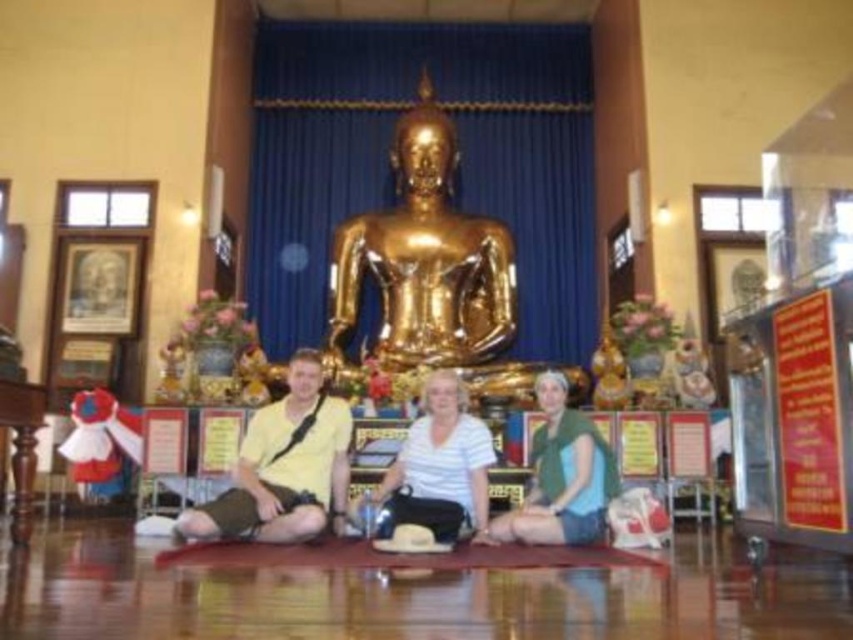
You are a tailor who needs to determine which shirt to alter first. Both the white matte shirt at center and the green matte shirt at center are on a hanger in front of you. Based on their sizes, which shirt requires more fabric to widen its width?

The green matte shirt at center requires more fabric to widen its width since it is wider than the white matte shirt at center.

You are an assistant in the temple and need to place a 1.2 meter tall offering on the altar. The altar has space for one shirt. Which shirt, the white matte shirt at center or the green matte shirt at center, should you choose to ensure the offering fits without exceeding the height limit?

The white matte shirt at center is taller than the green matte shirt at center. Therefore, placing the 1.2 meter tall offering on the white matte shirt at center would be appropriate as it can accommodate the height without exceeding the limit.

You are a visitor in this temple and notice two shirts at the center of the image. Which shirt is closer to you, the yellow matte shirt at center or the green matte shirt at center?

The yellow matte shirt at center is closer to you because it is in front of the green matte shirt at center.